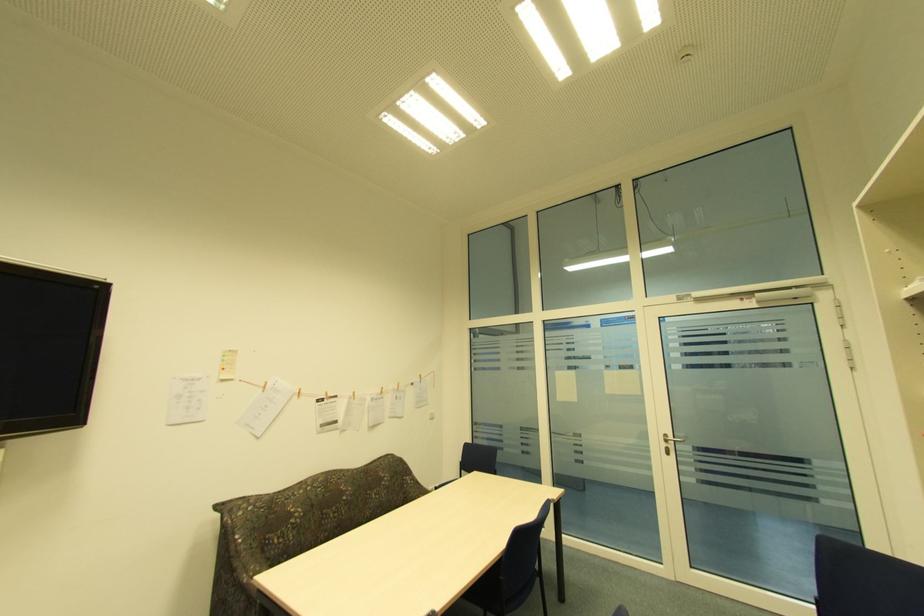
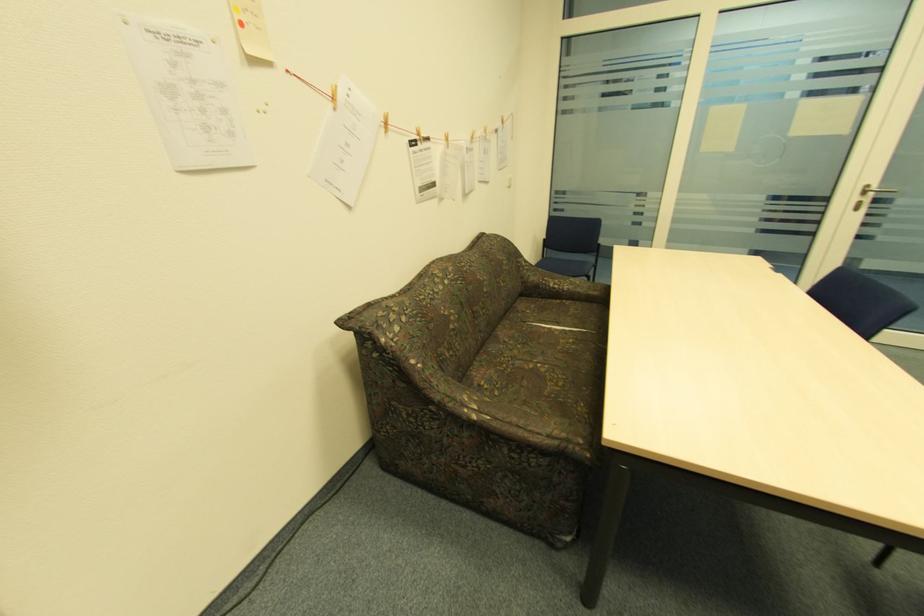
In the second image, find the point that corresponds to pixel 248 580 in the first image.

(477, 416)